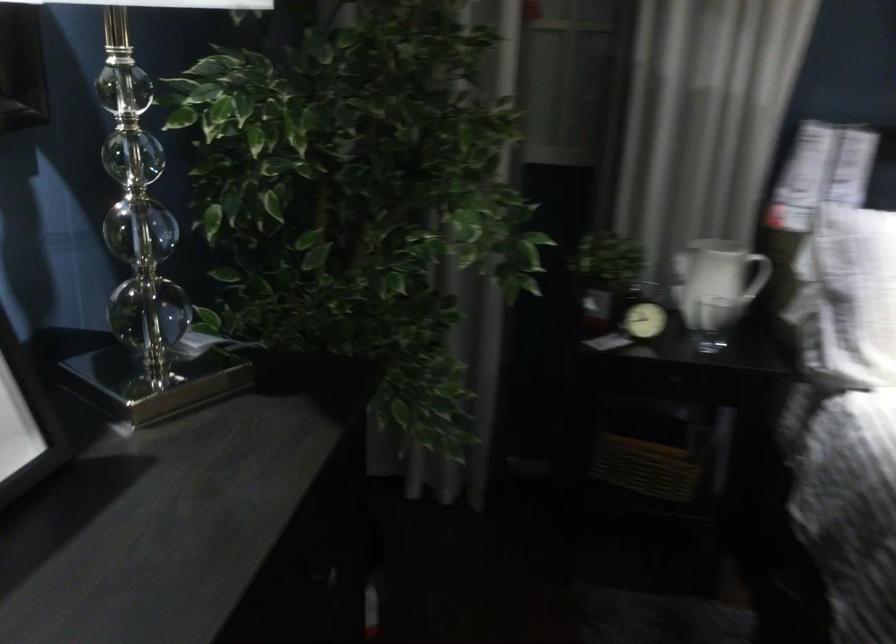
What do you see at coordinates (765, 276) in the screenshot?
I see `the white pitcher handle` at bounding box center [765, 276].